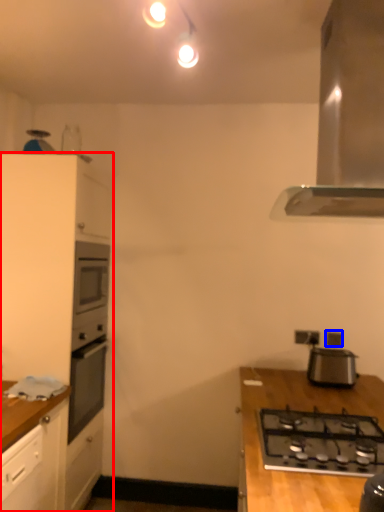
Question: Which point is closer to the camera, cabinetry (highlighted by a red box) or electric outlet (highlighted by a blue box)?

Choices:
 (A) cabinetry
 (B) electric outlet

Answer: (A)